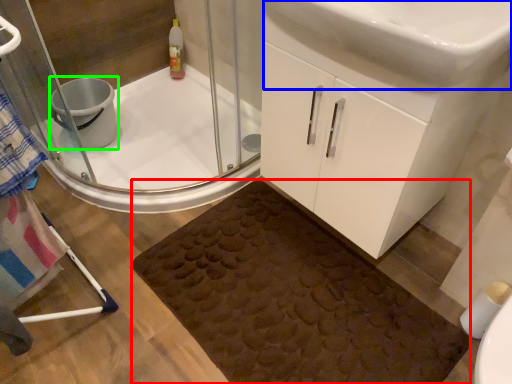
Question: Which object is positioned farthest from bath mat (highlighted by a red box)? Select from sink (highlighted by a blue box) and toilet bowl (highlighted by a green box).

Choices:
 (A) sink
 (B) toilet bowl

Answer: (B)